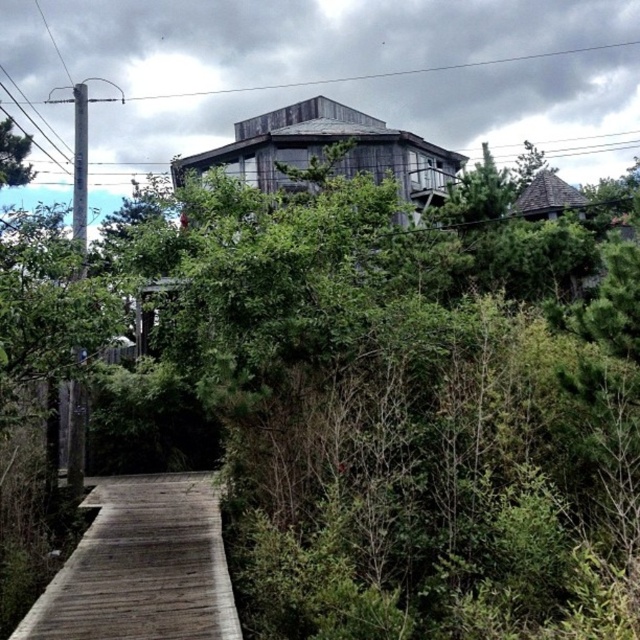
Question: Is wooden planks at lower left smaller than wooden hut at center?

Choices:
 (A) no
 (B) yes

Answer: (B)

Question: Considering the real-world distances, which object is closest to the wooden hut at center?

Choices:
 (A) brown shingled hut at upper right
 (B) wooden planks at lower left

Answer: (A)

Question: Which object appears farthest from the camera in this image?

Choices:
 (A) wooden planks at lower left
 (B) wooden hut at center
 (C) brown shingled hut at upper right

Answer: (C)

Question: Is wooden planks at lower left to the left of brown shingled hut at upper right from the viewer's perspective?

Choices:
 (A) yes
 (B) no

Answer: (A)

Question: Which of these objects is positioned farthest from the brown shingled hut at upper right?

Choices:
 (A) wooden hut at center
 (B) wooden planks at lower left

Answer: (B)

Question: Is wooden hut at center behind brown shingled hut at upper right?

Choices:
 (A) no
 (B) yes

Answer: (A)